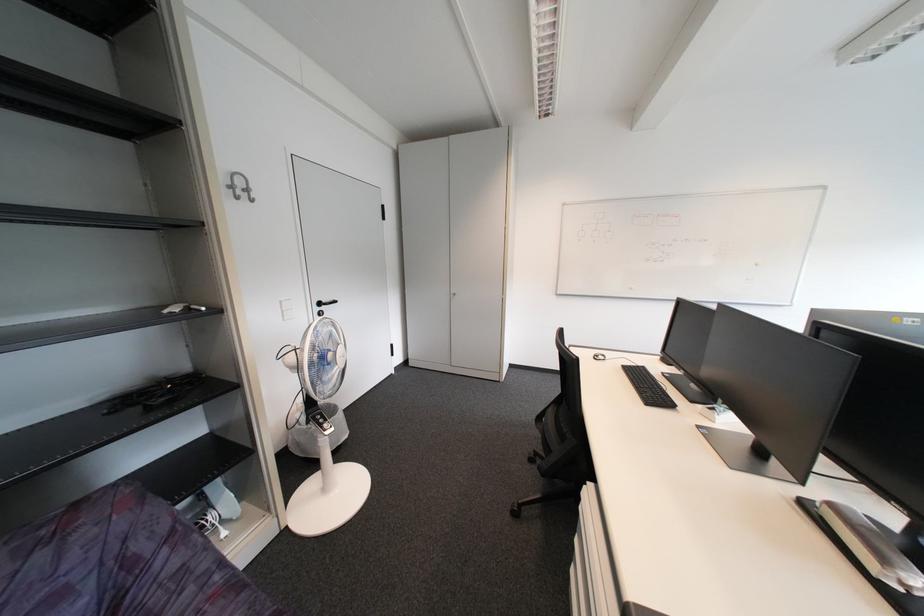
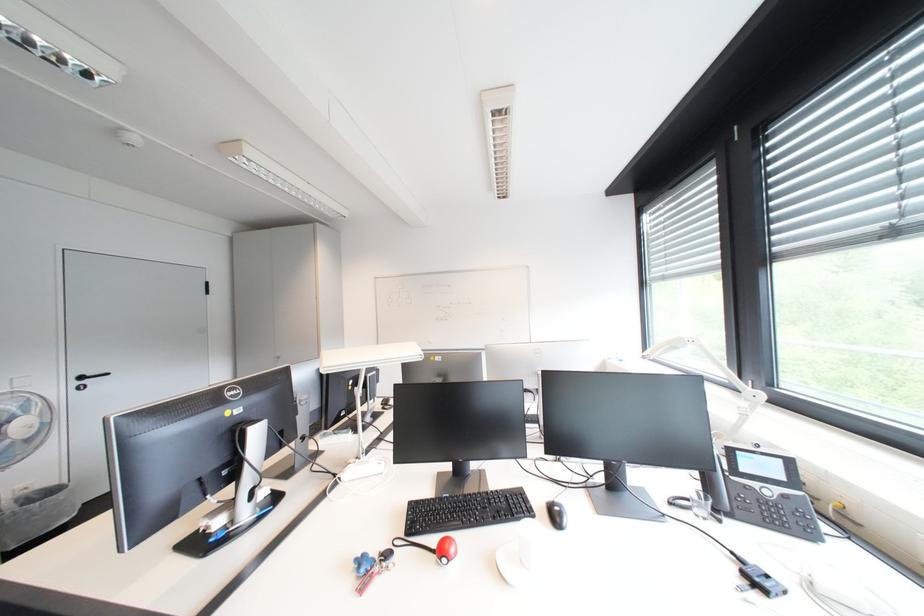
Which direction would the cameraman need to move to produce the second image?

The cameraman moved toward right, backward.